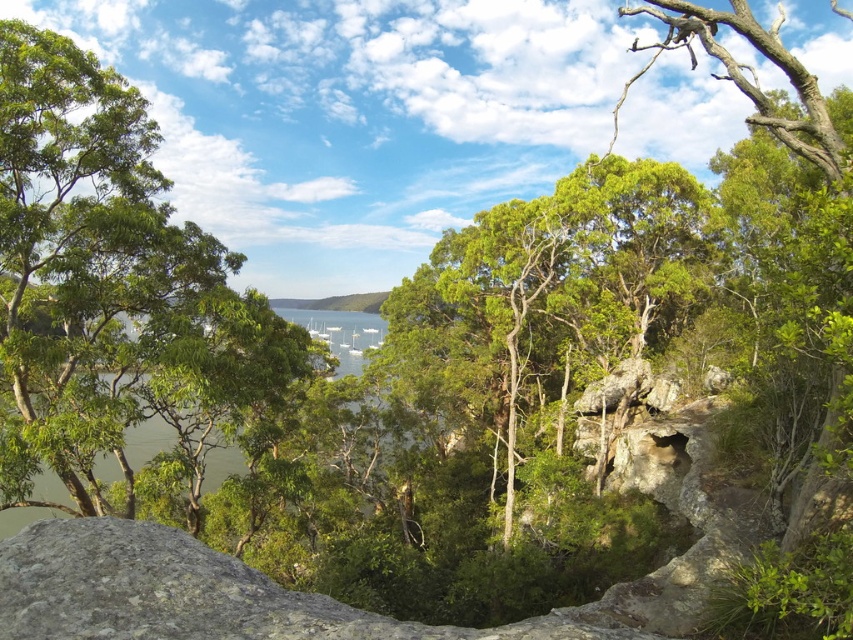
Question: Does green leafy tree at left have a smaller size compared to green water at center?

Choices:
 (A) no
 (B) yes

Answer: (B)

Question: Does green leafy tree at left appear on the left side of green leafy tree at center?

Choices:
 (A) yes
 (B) no

Answer: (A)

Question: Does green leafy tree at left appear under green leafy tree at center?

Choices:
 (A) no
 (B) yes

Answer: (A)

Question: Which of the following is the farthest from the observer?

Choices:
 (A) green leafy tree at left
 (B) green water at center
 (C) green leafy tree at center

Answer: (C)

Question: Which point is farther to the camera?

Choices:
 (A) (576, 237)
 (B) (341, 356)
 (C) (51, 262)

Answer: (B)

Question: Which is nearer to the green leafy tree at center?

Choices:
 (A) green leafy tree at left
 (B) green water at center

Answer: (B)